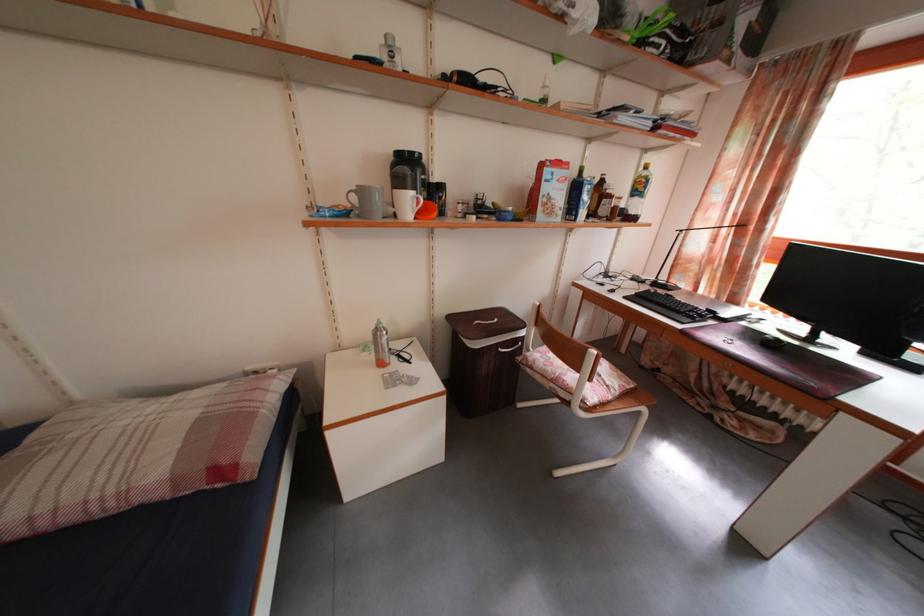
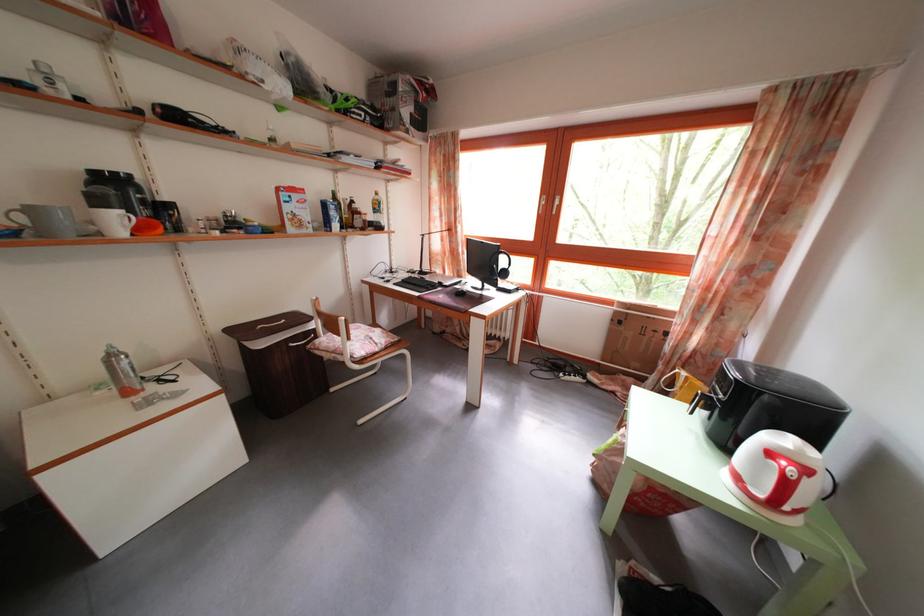
Locate, in the second image, the point that corresponds to pixel 419 389 in the first image.

(185, 402)